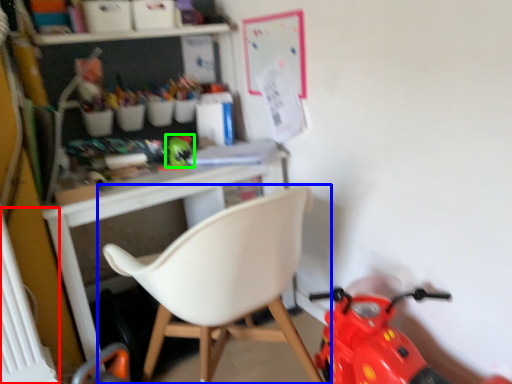
Question: Considering the real-world distances, which object is farthest from radiator (highlighted by a red box)? chair (highlighted by a blue box) or toy (highlighted by a green box)?

Choices:
 (A) chair
 (B) toy

Answer: (B)